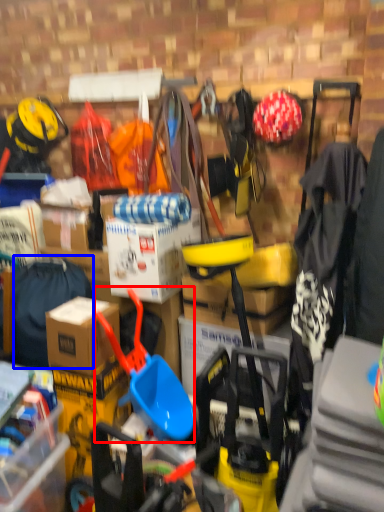
Question: Which of the following is the farthest to the observer, shovel (highlighted by a red box) or clothing (highlighted by a blue box)?

Choices:
 (A) shovel
 (B) clothing

Answer: (B)